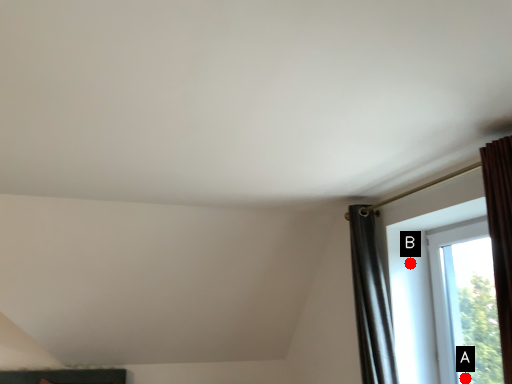
Question: Two points are circled on the image, labeled by A and B beside each circle. Which of the following is the farthest from the observer?

Choices:
 (A) A is further
 (B) B is further

Answer: (B)